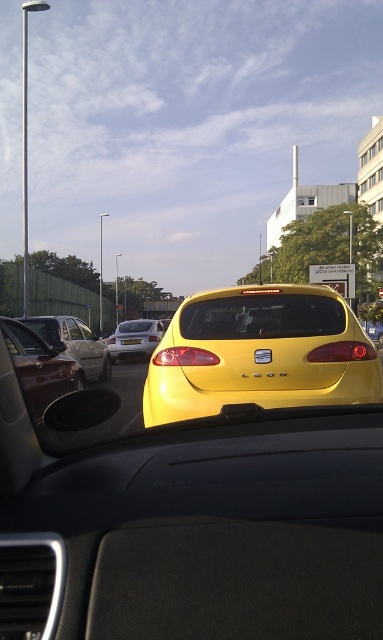
Question: Does shiny metallic car at left have a larger size compared to silver metallic sedan at center?

Choices:
 (A) no
 (B) yes

Answer: (A)

Question: Can you confirm if shiny metallic car at left is thinner than silver metallic sedan at center?

Choices:
 (A) yes
 (B) no

Answer: (A)

Question: Estimate the real-world distances between objects in this image. Which object is farther from the yellow matte license plate at center?

Choices:
 (A) shiny metallic car at left
 (B) matte black sedan at left

Answer: (A)

Question: Which object is farther from the camera taking this photo?

Choices:
 (A) yellow matte hatchback at center
 (B) shiny metallic car at left
 (C) matte black sedan at left
 (D) yellow matte license plate at center

Answer: (D)

Question: Where is yellow matte hatchback at center located in relation to shiny metallic car at left in the image?

Choices:
 (A) left
 (B) right

Answer: (B)

Question: Which object appears farthest from the camera in this image?

Choices:
 (A) yellow matte license plate at center
 (B) matte black sedan at left
 (C) shiny metallic car at left
 (D) yellow matte hatchback at center

Answer: (A)